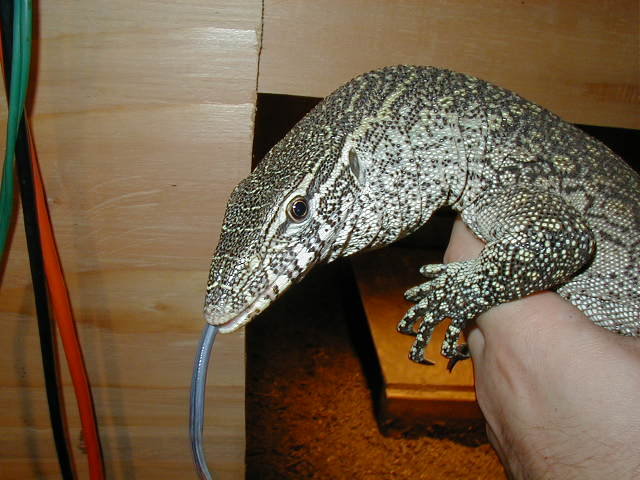
At what (x,y) coordinates should I click in order to perform the action: click on extension chord. Please return your answer as a coordinate pair (x, y). This screenshot has width=640, height=480. Looking at the image, I should click on (72, 351).